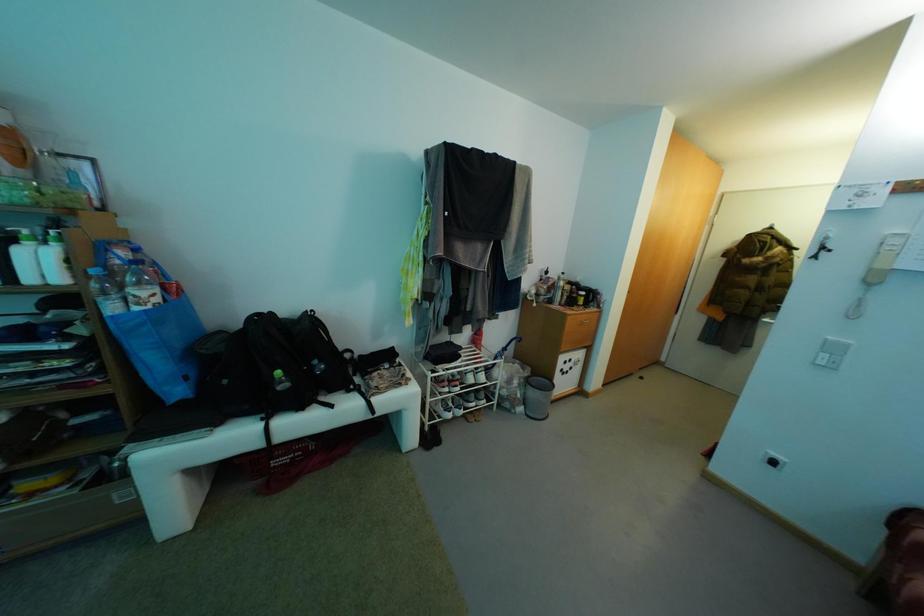
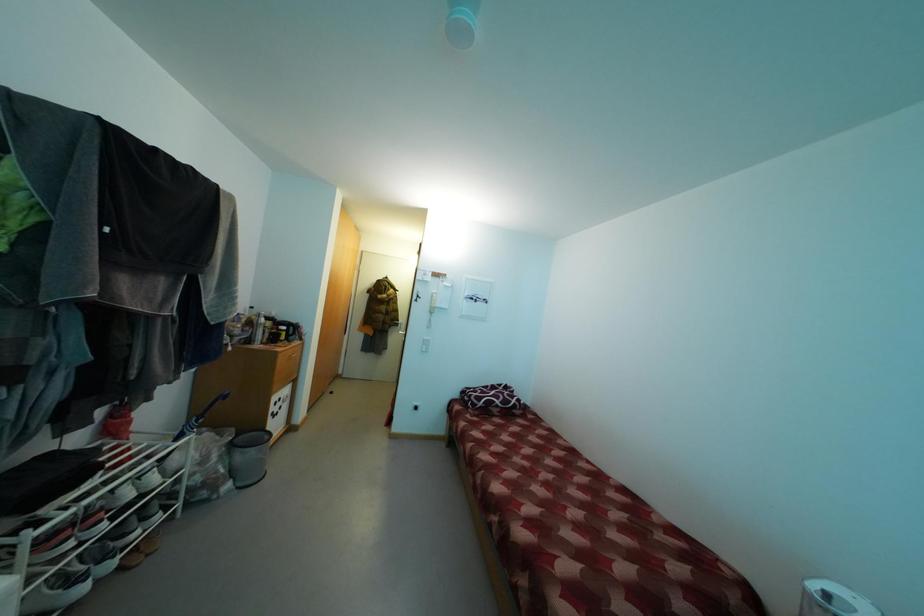
Question: The camera is either moving clockwise (left) or counter-clockwise (right) around the object. The first image is from the beginning of the video and the second image is from the end. Is the camera moving left or right when shooting the video?

Choices:
 (A) Left
 (B) Right

Answer: (A)